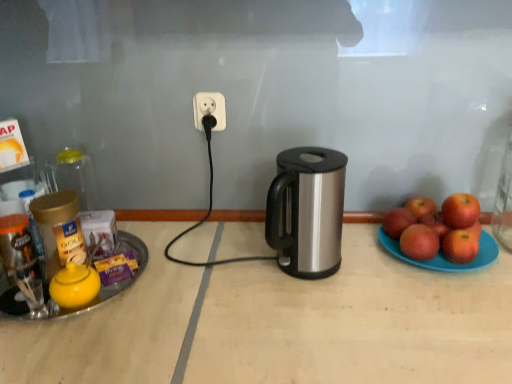
The height and width of the screenshot is (384, 512). What are the coordinates of `vacant area that lies in front of silver metallic kettle at center` in the screenshot? It's located at (320, 318).